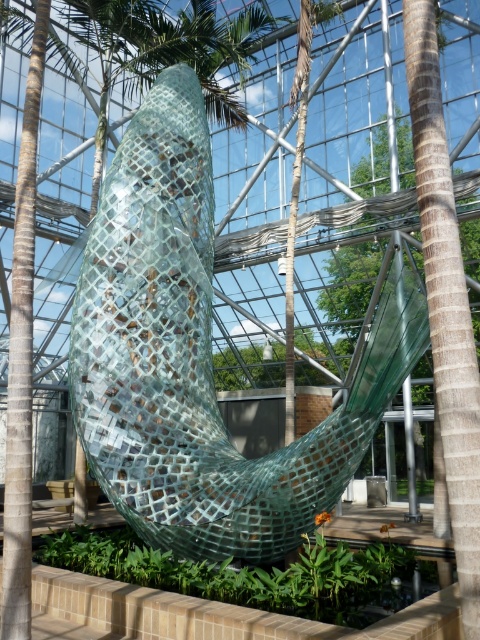
Question: Considering the relative positions of transparent glass sculpture at center and green textured glass at right in the image provided, where is transparent glass sculpture at center located with respect to green textured glass at right?

Choices:
 (A) left
 (B) right

Answer: (A)

Question: Does transparent glass sculpture at center appear over green textured glass at right?

Choices:
 (A) no
 (B) yes

Answer: (A)

Question: Which of the following is the closest to the observer?

Choices:
 (A) transparent glass sculpture at center
 (B) green textured glass at right

Answer: (A)

Question: Which point is closer to the camera taking this photo?

Choices:
 (A) (472, 228)
 (B) (113, 371)

Answer: (B)

Question: Is the position of transparent glass sculpture at center less distant than that of green textured glass at right?

Choices:
 (A) yes
 (B) no

Answer: (A)